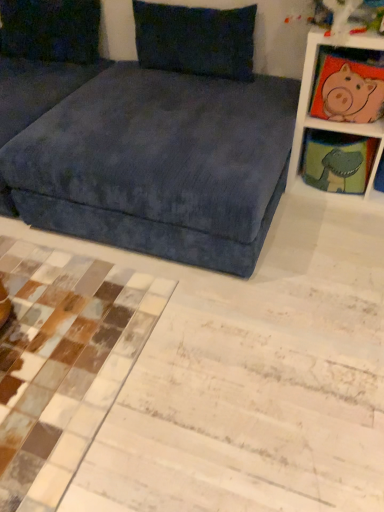
Where is `vacant area that lies between white wood shelf at upper right, placed as the first shelf when sorted from top to bottom, and velvet blue studio couch at upper center`? vacant area that lies between white wood shelf at upper right, placed as the first shelf when sorted from top to bottom, and velvet blue studio couch at upper center is located at coordinates (288, 298).